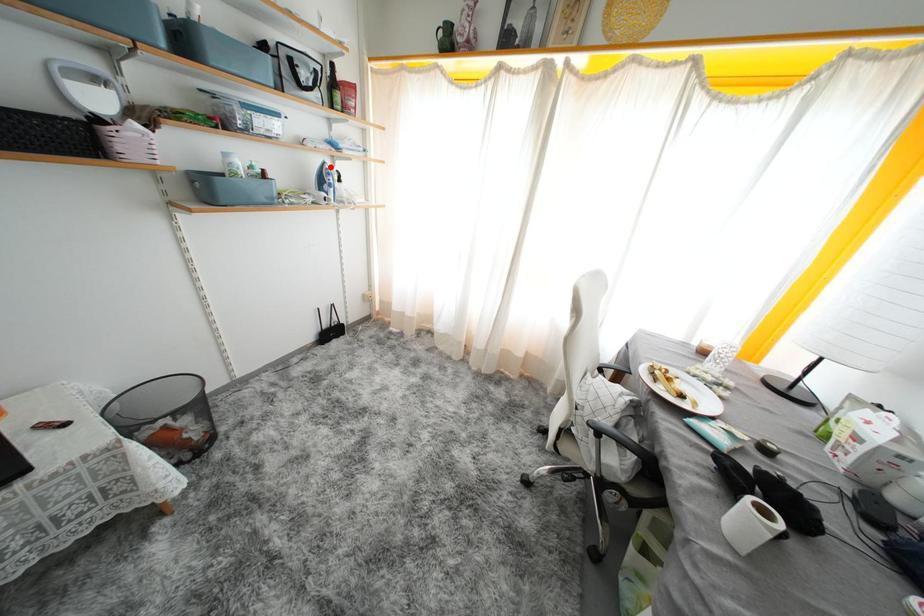
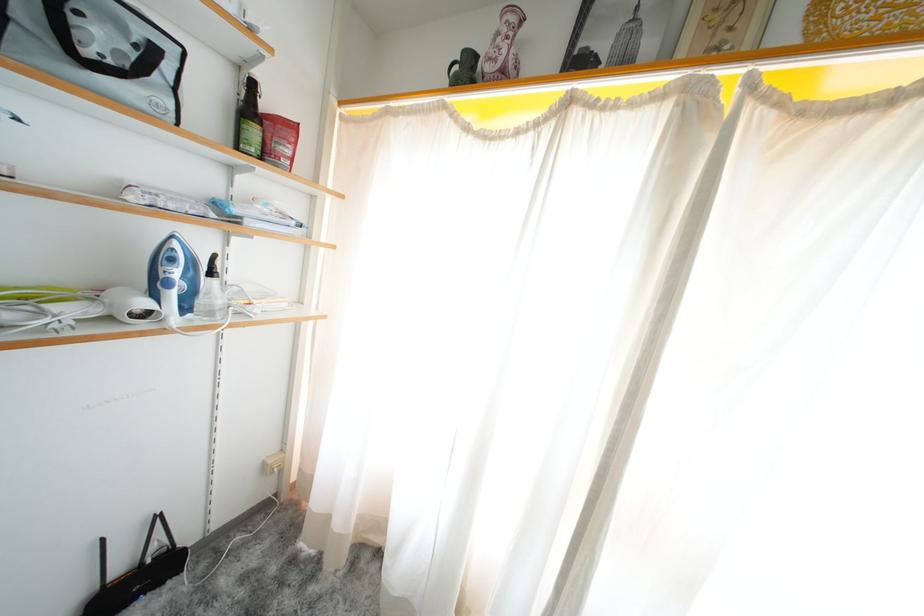
Question: I am providing you with two images of the same scene from different viewpoints. Given a red point in image1, look at the same physical point in image2. Is it:

Choices:
 (A) Closer to the viewpoint
 (B) Farther from the viewpoint

Answer: (B)